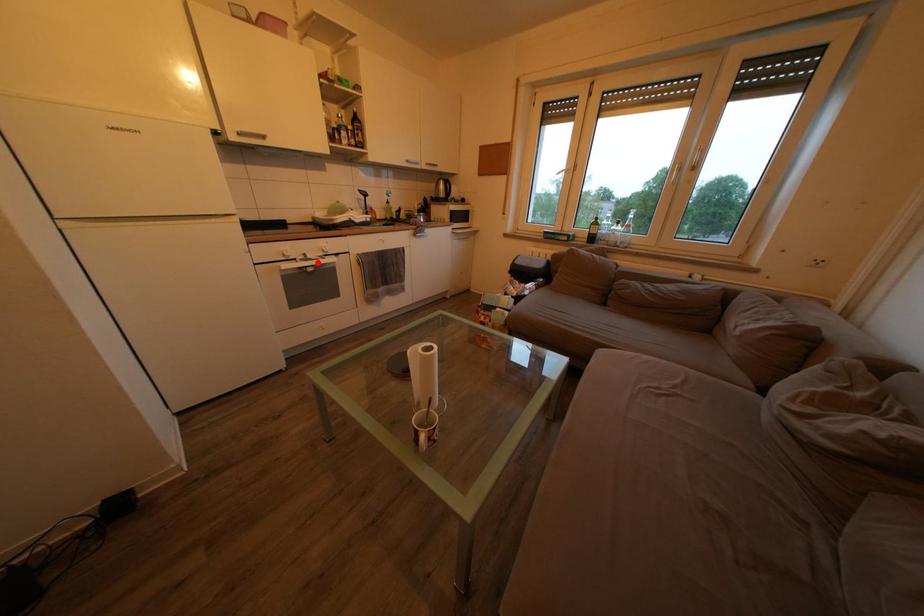
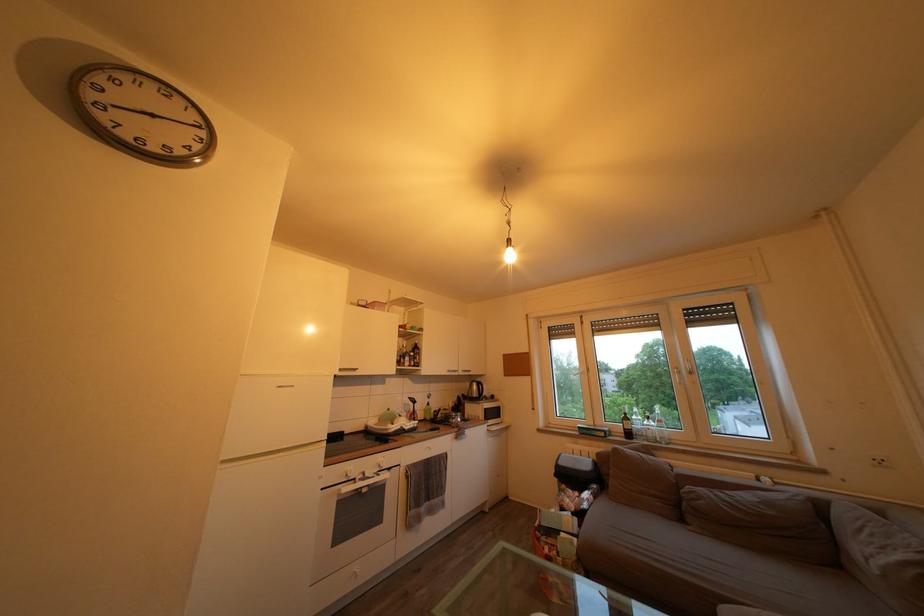
Question: A red point is marked in image1. In image2, is the corresponding 3D point closer to the camera or farther? Reply with the corresponding letter.

Choices:
 (A) The corresponding 3D point is closer.
 (B) The corresponding 3D point is farther.

Answer: (B)